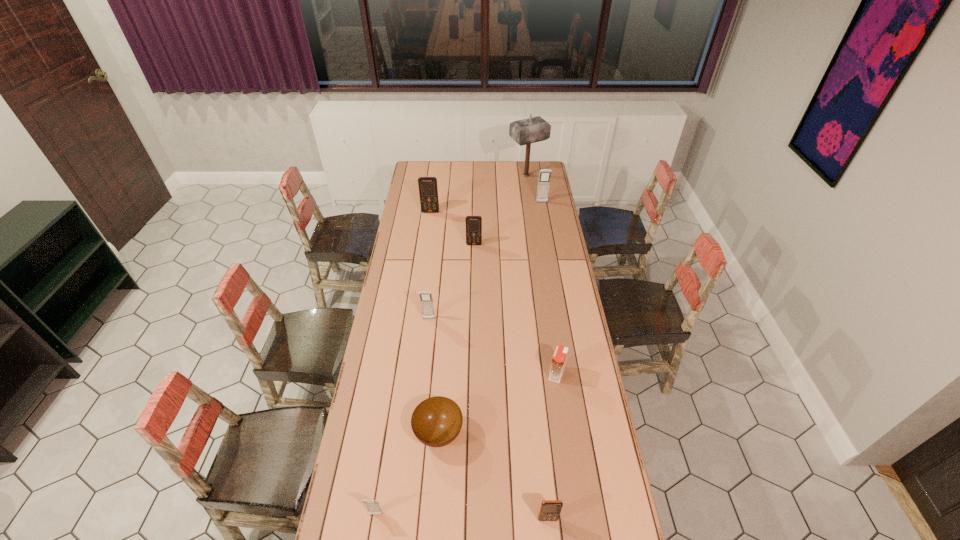
At what (x,y) coordinates should I click in order to perform the action: click on vacant area situated 0.140m on the screen of the farthest orange cellular telephone. Please return your answer as a coordinate pair (x, y). The height and width of the screenshot is (540, 960). Looking at the image, I should click on (428, 229).

Where is `vacant region located 0.260m on the front-facing side of the fifth farthest object`? The height and width of the screenshot is (540, 960). vacant region located 0.260m on the front-facing side of the fifth farthest object is located at coordinates (422, 372).

Locate an element on the screen. The image size is (960, 540). free spot located on the screen of the fourth farthest object is located at coordinates (473, 293).

What are the coordinates of `vacant region located 0.080m on the back of the orange juice` in the screenshot? It's located at (553, 349).

In order to click on vacant region located 0.090m on the right of the bowl in this screenshot , I will do `click(490, 433)`.

This screenshot has width=960, height=540. I want to click on object positioned at the far edge, so click(534, 129).

You are a GUI agent. You are given a task and a screenshot of the screen. Output one action in this format:
    pyautogui.click(x=<x>, y=<y>)
    Task: Click on the mallet at the right edge
    This screenshot has width=960, height=540.
    Given the screenshot: What is the action you would take?
    pyautogui.click(x=534, y=129)

This screenshot has height=540, width=960. In order to click on cellular telephone at the right edge in this screenshot , I will do `click(545, 174)`.

Locate an element on the screen. The width and height of the screenshot is (960, 540). orange juice that is at the right edge is located at coordinates (559, 358).

Find the location of a particular element. This screenshot has width=960, height=540. object located in the far right corner section of the desktop is located at coordinates (534, 129).